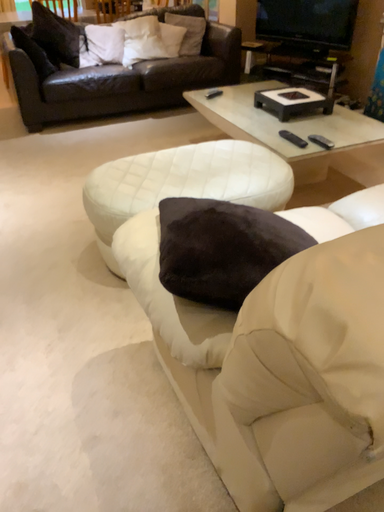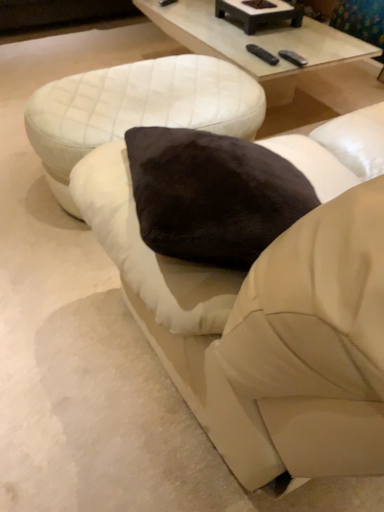
Question: Which way did the camera rotate in the video?

Choices:
 (A) rotated right
 (B) rotated left

Answer: (A)